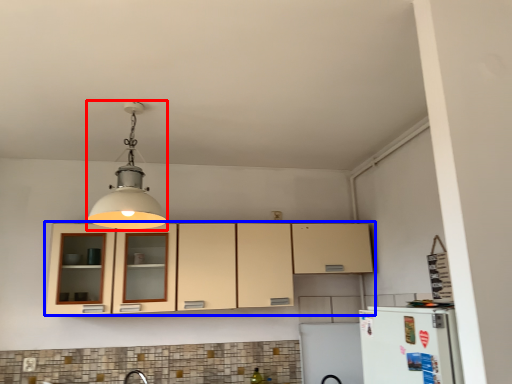
Question: Which object appears farthest to the camera in this image, light fixture (highlighted by a red box) or cabinetry (highlighted by a blue box)?

Choices:
 (A) light fixture
 (B) cabinetry

Answer: (B)